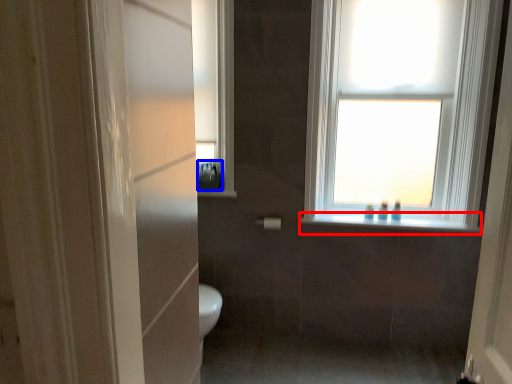
Question: Which object appears closest to the camera in this image, window sill (highlighted by a red box) or toiletry (highlighted by a blue box)?

Choices:
 (A) window sill
 (B) toiletry

Answer: (A)